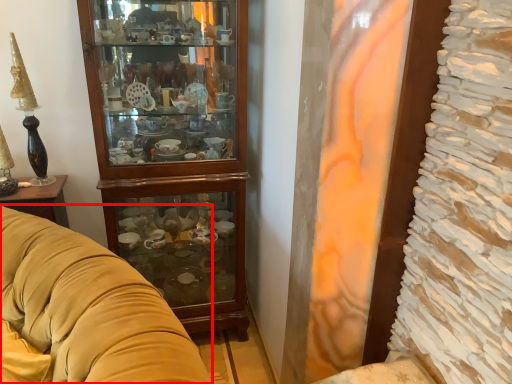
Question: Observing the image, what is the correct spatial positioning of studio couch (annotated by the red box) in reference to cabinetry?

Choices:
 (A) left
 (B) right

Answer: (A)